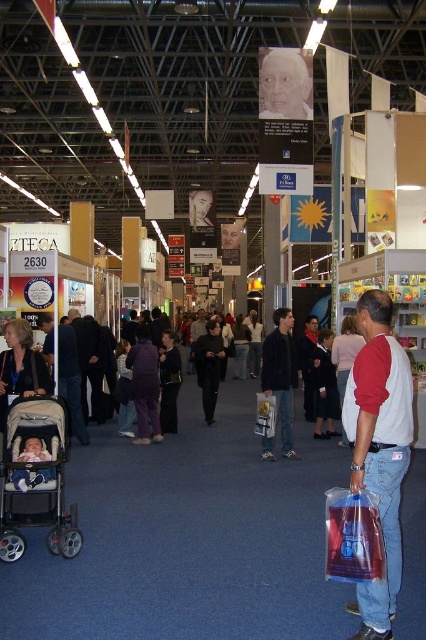
Between dark gray pants at center and blue fabric baby carriage at lower left, which one is positioned lower?

blue fabric baby carriage at lower left is lower down.

How much distance is there between dark gray pants at center and blue fabric baby carriage at lower left?

dark gray pants at center and blue fabric baby carriage at lower left are 4.69 meters apart.

Where is `dark gray pants at center`? This screenshot has width=426, height=640. dark gray pants at center is located at coordinates (89, 362).

Is white/red long-sleeved shirt at right wider than beige fabric stroller at lower left?

No, white/red long-sleeved shirt at right is not wider than beige fabric stroller at lower left.

Image resolution: width=426 pixels, height=640 pixels. What do you see at coordinates (379, 449) in the screenshot? I see `white/red long-sleeved shirt at right` at bounding box center [379, 449].

The image size is (426, 640). Find the location of `white/red long-sleeved shirt at right`. white/red long-sleeved shirt at right is located at coordinates (x=379, y=449).

Can you confirm if beige fabric stroller at lower left is positioned to the right of dark gray pants at center?

Yes, beige fabric stroller at lower left is to the right of dark gray pants at center.

Is beige fabric stroller at lower left to the left of dark gray pants at center from the viewer's perspective?

In fact, beige fabric stroller at lower left is to the right of dark gray pants at center.

This screenshot has width=426, height=640. Describe the element at coordinates (36, 480) in the screenshot. I see `beige fabric stroller at lower left` at that location.

Find the location of `beige fabric stroller at lower left`. beige fabric stroller at lower left is located at coordinates (36, 480).